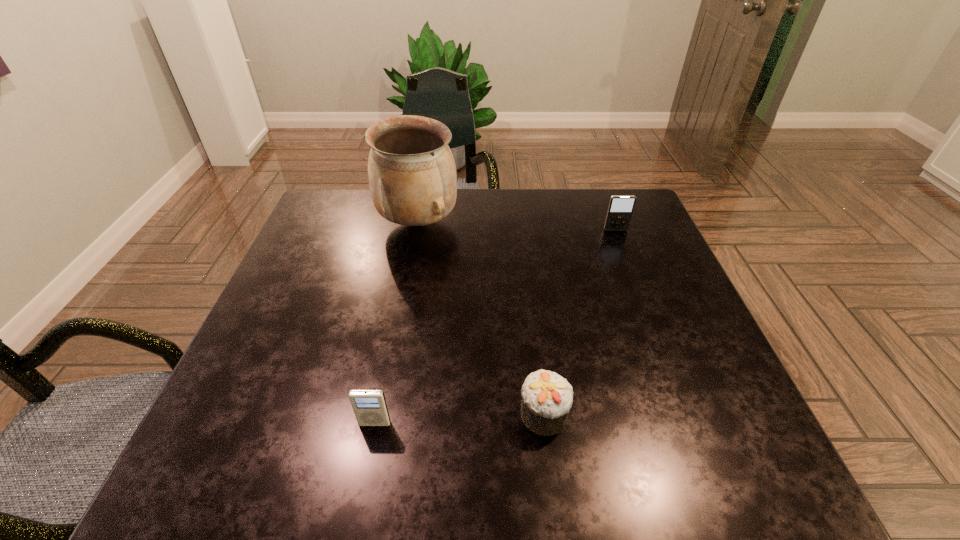
I want to click on object identified as the third closest to the right iPod, so click(x=369, y=406).

You are a GUI agent. You are given a task and a screenshot of the screen. Output one action in this format:
    pyautogui.click(x=<x>, y=<y>)
    Task: Click on the vacant space that satisfies the following two spatial constraints: 1. on the front side of the urn; 2. on the left side of the third object from left to right
    
    Given the screenshot: What is the action you would take?
    pyautogui.click(x=384, y=414)

Where is `free space that satisfies the following two spatial constraints: 1. on the front side of the urn; 2. on the left side of the cupcake`? This screenshot has width=960, height=540. free space that satisfies the following two spatial constraints: 1. on the front side of the urn; 2. on the left side of the cupcake is located at coordinates (384, 414).